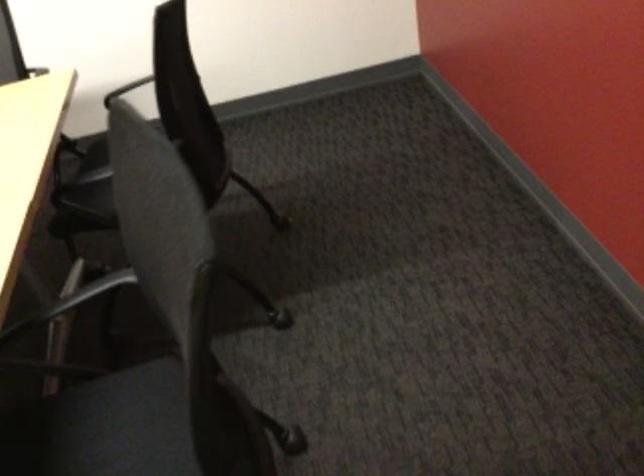
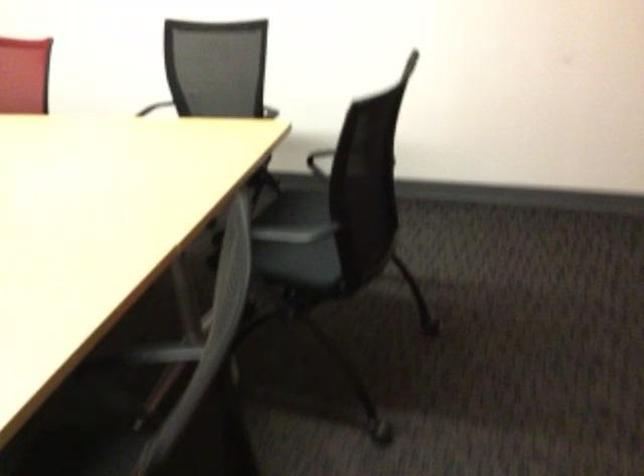
Question: The camera is either moving clockwise (left) or counter-clockwise (right) around the object. The first image is from the beginning of the video and the second image is from the end. Is the camera moving left or right when shooting the video?

Choices:
 (A) Left
 (B) Right

Answer: (B)